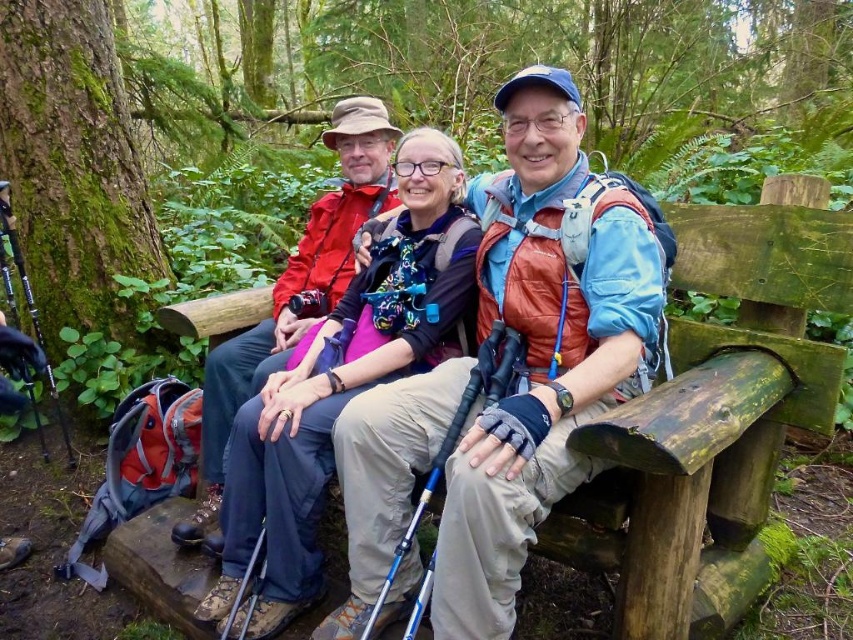
Question: Does matte blue jacket at center have a lesser width compared to weathered wood bench at center?

Choices:
 (A) yes
 (B) no

Answer: (B)

Question: Which object is the farthest from the matte blue jacket at center?

Choices:
 (A) matte purple jacket at center
 (B) green mossy bark at left

Answer: (B)

Question: Considering the real-world distances, which object is closest to the weathered wood bench at center?

Choices:
 (A) matte purple jacket at center
 (B) green mossy bark at left

Answer: (A)

Question: Which is farther from the weathered wood bench at center?

Choices:
 (A) green mossy bark at left
 (B) matte purple jacket at center

Answer: (A)

Question: Does matte blue jacket at center appear on the right side of matte purple jacket at center?

Choices:
 (A) no
 (B) yes

Answer: (B)

Question: From the image, what is the correct spatial relationship of weathered wood bench at center in relation to green mossy bark at left?

Choices:
 (A) right
 (B) left

Answer: (A)